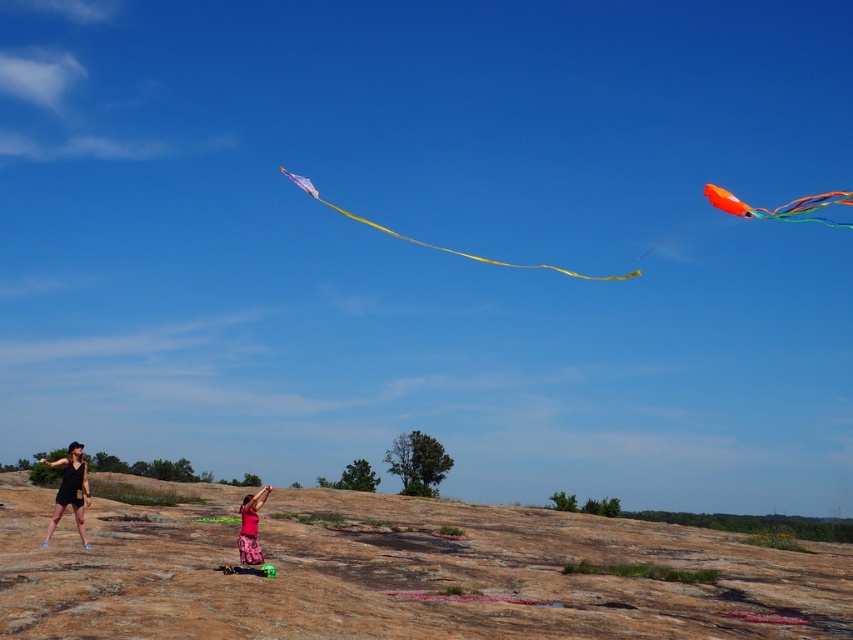
You are a photographer trying to capture both the matte black shorts at lower left and the translucent purple kite at center in a single frame. Based on their sizes in the image, which object would appear smaller in the photo?

The matte black shorts at lower left has a lesser width compared to the translucent purple kite at center, so it would appear smaller in the photo.

You are a photographer trying to capture a photo of the translucent purple kite at center. You are standing near the person wearing the matte black shorts at lower left. To get a clear shot of the kite, should you move to your left or right?

The matte black shorts at lower left is positioned on the left side of the translucent purple kite at center, so to get a clear shot of the translucent purple kite at center, you should move to your right to avoid blocking the kite with the person wearing the matte black shorts at lower left.

You are standing at the point marked by coordinates point (780, 205) in the image. Looking around, you see the orange glossy kite at upper right and the purple and white kite with a long yellow tail. Which kite is closer to your current position?

The point (780, 205) indicates orange glossy kite at upper right, so you are at the location of the orange glossy kite at upper right. Therefore, the orange glossy kite at upper right is at your current position, making it the closest to you.